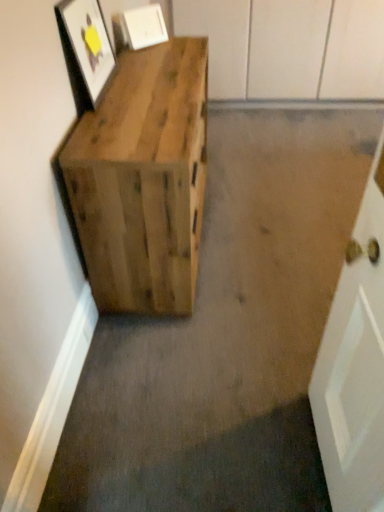
What are the coordinates of `empty space that is ontop of matte white picture frame at upper center, the first picture frame viewed from the back (from a real-world perspective)` in the screenshot? It's located at (142, 2).